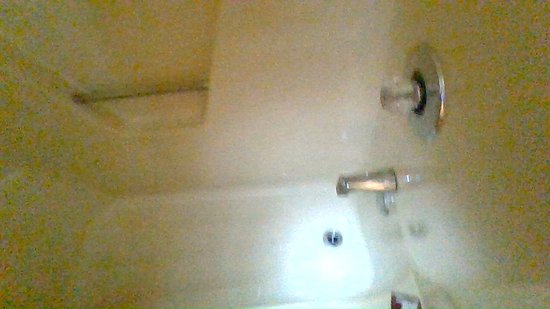
I want to click on steel handle, so click(x=153, y=92).